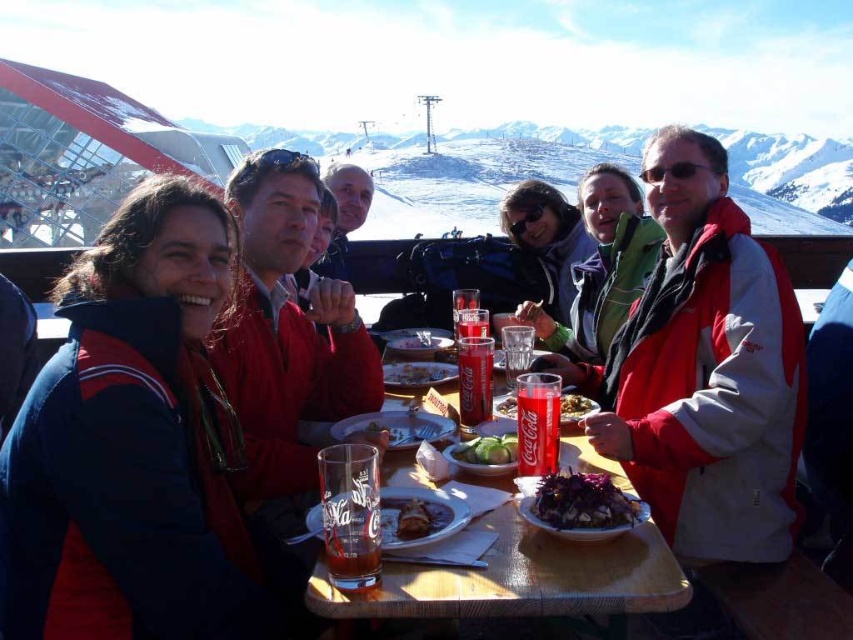
Question: Where is blue fleece jacket at left located in relation to shiny brown meat at center in the image?

Choices:
 (A) below
 (B) above

Answer: (B)

Question: Which of the following is the closest to the observer?

Choices:
 (A) (724, 452)
 (B) (422, 378)
 (C) (553, 468)

Answer: (C)

Question: Considering the real-world distances, which object is closest to the purple matte salad at center?

Choices:
 (A) wooden table at center
 (B) blue fleece jacket at left
 (C) green leafy salad at center
 (D) matte black jacket at center

Answer: (A)

Question: Among these objects, which one is farthest from the camera?

Choices:
 (A) coca-cola glass at center
 (B) smooth yellow cheese at center
 (C) shiny brown meat at center
 (D) red jacket at right

Answer: (B)

Question: Does matte black jacket at center come behind purple matte salad at center?

Choices:
 (A) yes
 (B) no

Answer: (A)

Question: Does red jacket at right appear under green leafy salad at center?

Choices:
 (A) no
 (B) yes

Answer: (A)